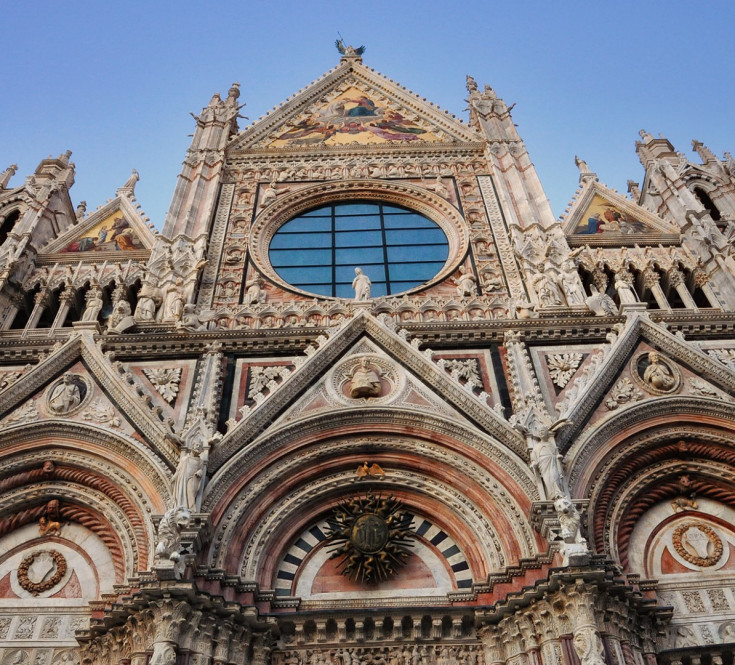
What are the coordinates of `busts` in the screenshot? It's located at (60, 392), (356, 378), (656, 370).